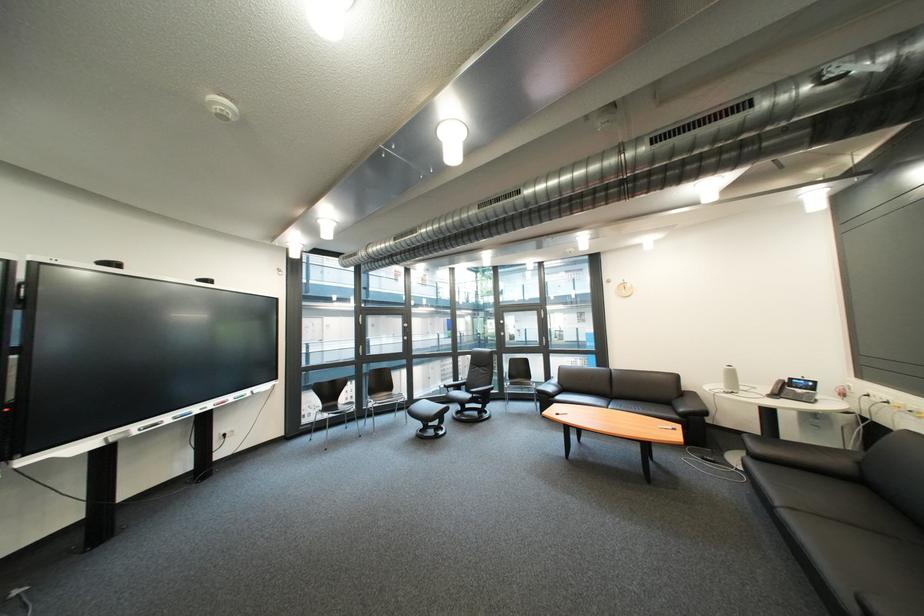
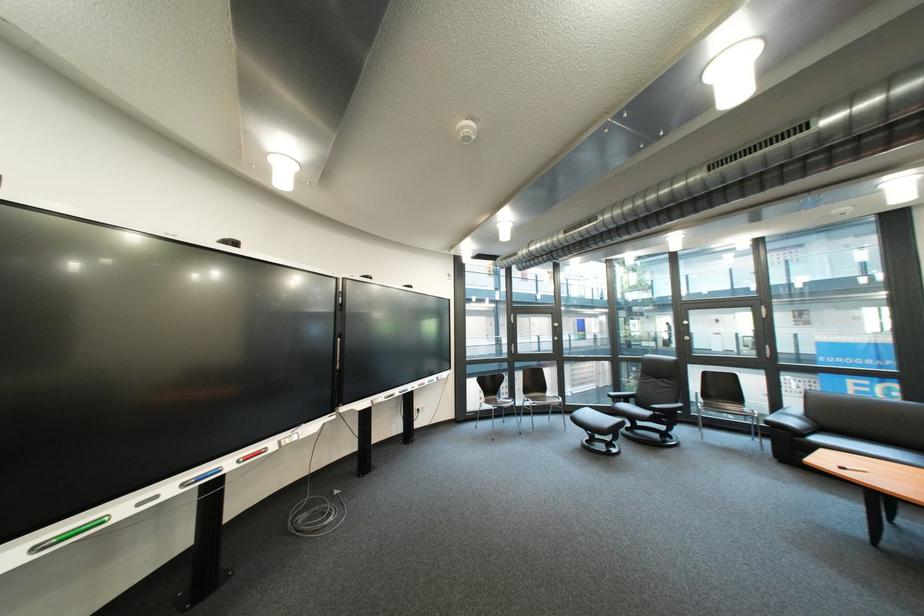
In the second image, find the point that corresponds to (x=573, y=415) in the first image.

(862, 469)